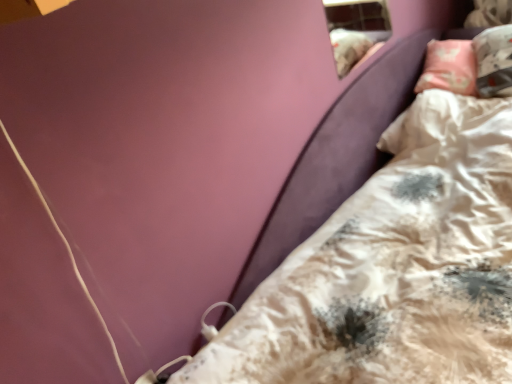
Question: Is transparent glass window at upper right smaller than velvet purple bed at lower right?

Choices:
 (A) no
 (B) yes

Answer: (B)

Question: From a real-world perspective, does transparent glass window at upper right stand above velvet purple bed at lower right?

Choices:
 (A) no
 (B) yes

Answer: (B)

Question: Is transparent glass window at upper right looking in the opposite direction of velvet purple bed at lower right?

Choices:
 (A) yes
 (B) no

Answer: (B)

Question: From the image's perspective, is transparent glass window at upper right on top of velvet purple bed at lower right?

Choices:
 (A) yes
 (B) no

Answer: (A)

Question: Is transparent glass window at upper right closer to camera compared to velvet purple bed at lower right?

Choices:
 (A) yes
 (B) no

Answer: (B)

Question: Is transparent glass window at upper right directly adjacent to velvet purple bed at lower right?

Choices:
 (A) no
 (B) yes

Answer: (A)

Question: Considering the relative sizes of velvet purple bed at lower right and transparent glass window at upper right in the image provided, is velvet purple bed at lower right taller than transparent glass window at upper right?

Choices:
 (A) yes
 (B) no

Answer: (B)

Question: Does velvet purple bed at lower right have a lesser width compared to transparent glass window at upper right?

Choices:
 (A) no
 (B) yes

Answer: (A)

Question: From the image's perspective, is velvet purple bed at lower right over transparent glass window at upper right?

Choices:
 (A) no
 (B) yes

Answer: (A)

Question: Is velvet purple bed at lower right far from transparent glass window at upper right?

Choices:
 (A) no
 (B) yes

Answer: (A)

Question: From the image's perspective, is velvet purple bed at lower right located beneath transparent glass window at upper right?

Choices:
 (A) no
 (B) yes

Answer: (B)

Question: From a real-world perspective, is velvet purple bed at lower right on transparent glass window at upper right?

Choices:
 (A) yes
 (B) no

Answer: (B)

Question: From a real-world perspective, is velvet purple bed at lower right above or below transparent glass window at upper right?

Choices:
 (A) below
 (B) above

Answer: (A)